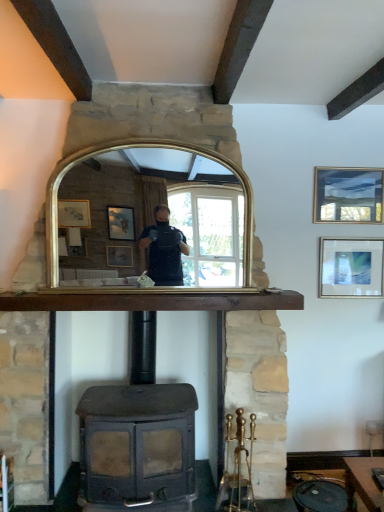
The width and height of the screenshot is (384, 512). What are the coordinates of `matte gold picture frame at upper right, which ranks as the 1th picture frame in top-to-bottom order` in the screenshot? It's located at (348, 195).

Describe the element at coordinates (351, 268) in the screenshot. The image size is (384, 512). I see `matte silver picture frame at upper right, which appears as the second picture frame when viewed from the top` at that location.

Where is `matte silver picture frame at upper right, which appears as the second picture frame when viewed from the top`? matte silver picture frame at upper right, which appears as the second picture frame when viewed from the top is located at coordinates (351, 268).

What do you see at coordinates (212, 226) in the screenshot? The height and width of the screenshot is (512, 384). I see `gold-framed mirror at center` at bounding box center [212, 226].

Locate an element on the screen. The height and width of the screenshot is (512, 384). matte black wood burning stove at center is located at coordinates (138, 435).

This screenshot has height=512, width=384. I want to click on mirror lying above the matte black wood burning stove at center (from the image's perspective), so click(x=212, y=226).

Which object is thinner, gold-framed mirror at center or matte black wood burning stove at center?

gold-framed mirror at center.

What's the angular difference between gold-framed mirror at center and matte black wood burning stove at center's facing directions?

1.44 degrees separate the facing orientations of gold-framed mirror at center and matte black wood burning stove at center.

Considering the sizes of objects gold-framed mirror at center and matte black wood burning stove at center in the image provided, who is taller, gold-framed mirror at center or matte black wood burning stove at center?

matte black wood burning stove at center.

Which object is positioned more to the left, gold-framed mirror at center or brown wooden mantle at center?

brown wooden mantle at center is more to the left.

From the image's perspective, is gold-framed mirror at center below brown wooden mantle at center?

Actually, gold-framed mirror at center appears above brown wooden mantle at center in the image.

Is gold-framed mirror at center inside or outside of brown wooden mantle at center?

gold-framed mirror at center exists outside the volume of brown wooden mantle at center.

In the image, is matte silver picture frame at upper right, the first picture frame in the bottom-to-top sequence, positioned in front of or behind brown wooden mantle at center?

matte silver picture frame at upper right, the first picture frame in the bottom-to-top sequence, is positioned farther from the viewer than brown wooden mantle at center.

Is matte silver picture frame at upper right, the first picture frame in the bottom-to-top sequence, aimed at brown wooden mantle at center?

No, matte silver picture frame at upper right, the first picture frame in the bottom-to-top sequence, does not turn towards brown wooden mantle at center.

Identify the location of mantle in front of the matte silver picture frame at upper right, the first picture frame in the bottom-to-top sequence. The width and height of the screenshot is (384, 512). (148, 300).

Looking at this image, which of these two, matte silver picture frame at upper right, the first picture frame in the bottom-to-top sequence, or brown wooden mantle at center, is bigger?

Bigger between the two is brown wooden mantle at center.

Is brown wooden mantle at center looking in the opposite direction of matte gold picture frame at upper right, the second picture frame ordered from the bottom?

brown wooden mantle at center does not have its back to matte gold picture frame at upper right, the second picture frame ordered from the bottom.

From a real-world perspective, who is located higher, brown wooden mantle at center or matte gold picture frame at upper right, the second picture frame ordered from the bottom?

From a 3D spatial view, matte gold picture frame at upper right, the second picture frame ordered from the bottom, is above.

Find the location of a particular element. picture frame that is the 2nd object located above the brown wooden mantle at center (from the image's perspective) is located at coordinates (348, 195).

From their relative heights in the image, would you say brown wooden mantle at center is taller or shorter than matte gold picture frame at upper right, which ranks as the 1th picture frame in top-to-bottom order?

Considering their sizes, brown wooden mantle at center has less height than matte gold picture frame at upper right, which ranks as the 1th picture frame in top-to-bottom order.

Does point (220, 295) appear closer or farther from the camera than point (91, 248)?

Point (220, 295) is closer to the camera than point (91, 248).

Find the location of a particular element. mantle beneath the gold-framed mirror at center (from a real-world perspective) is located at coordinates (148, 300).

Is brown wooden mantle at center with gold-framed mirror at center?

brown wooden mantle at center and gold-framed mirror at center are clearly separated.

Who is smaller, matte silver picture frame at upper right, the first picture frame in the bottom-to-top sequence, or matte gold picture frame at upper right, which ranks as the 1th picture frame in top-to-bottom order?

With smaller size is matte gold picture frame at upper right, which ranks as the 1th picture frame in top-to-bottom order.

Can you confirm if matte silver picture frame at upper right, which appears as the second picture frame when viewed from the top, is positioned to the left of matte gold picture frame at upper right, which ranks as the 1th picture frame in top-to-bottom order?

In fact, matte silver picture frame at upper right, which appears as the second picture frame when viewed from the top, is to the right of matte gold picture frame at upper right, which ranks as the 1th picture frame in top-to-bottom order.

In the scene shown: Is matte silver picture frame at upper right, which appears as the second picture frame when viewed from the top, positioned far away from matte gold picture frame at upper right, which ranks as the 1th picture frame in top-to-bottom order?

No.

Would you say matte silver picture frame at upper right, which appears as the second picture frame when viewed from the top, is outside matte gold picture frame at upper right, which ranks as the 1th picture frame in top-to-bottom order?

That's correct, matte silver picture frame at upper right, which appears as the second picture frame when viewed from the top, is outside of matte gold picture frame at upper right, which ranks as the 1th picture frame in top-to-bottom order.

Considering the sizes of objects matte black wood burning stove at center and matte silver picture frame at upper right, which appears as the second picture frame when viewed from the top, in the image provided, who is taller, matte black wood burning stove at center or matte silver picture frame at upper right, which appears as the second picture frame when viewed from the top,?

With more height is matte black wood burning stove at center.

Which object is thinner, matte black wood burning stove at center or matte silver picture frame at upper right, which appears as the second picture frame when viewed from the top?

Thinner between the two is matte silver picture frame at upper right, which appears as the second picture frame when viewed from the top.

From the picture: Is matte black wood burning stove at center spatially inside matte silver picture frame at upper right, the first picture frame in the bottom-to-top sequence, or outside of it?

The correct answer is: outside.

Identify the location of wood burning stove below the gold-framed mirror at center (from the image's perspective). (138, 435).

I want to click on mantle directly beneath the gold-framed mirror at center (from a real-world perspective), so click(148, 300).

Considering their positions, is brown wooden mantle at center positioned further to matte silver picture frame at upper right, the first picture frame in the bottom-to-top sequence, than matte gold picture frame at upper right, the second picture frame ordered from the bottom?

brown wooden mantle at center is further to matte silver picture frame at upper right, the first picture frame in the bottom-to-top sequence.

When comparing their distances from brown wooden mantle at center, does gold-framed mirror at center or matte black wood burning stove at center seem closer?

The object closer to brown wooden mantle at center is gold-framed mirror at center.

Based on their spatial positions, is matte gold picture frame at upper right, which ranks as the 1th picture frame in top-to-bottom order, or matte silver picture frame at upper right, the first picture frame in the bottom-to-top sequence, closer to brown wooden mantle at center?

matte silver picture frame at upper right, the first picture frame in the bottom-to-top sequence, lies closer to brown wooden mantle at center than the other object.

Which object lies nearer to the anchor point matte silver picture frame at upper right, which appears as the second picture frame when viewed from the top, gold-framed mirror at center or brown wooden mantle at center?

The object closer to matte silver picture frame at upper right, which appears as the second picture frame when viewed from the top, is brown wooden mantle at center.

From the image, which object appears to be nearer to brown wooden mantle at center, matte silver picture frame at upper right, the first picture frame in the bottom-to-top sequence, or matte black wood burning stove at center?

matte black wood burning stove at center is closer to brown wooden mantle at center.

When comparing their distances from matte gold picture frame at upper right, the second picture frame ordered from the bottom, does brown wooden mantle at center or matte silver picture frame at upper right, which appears as the second picture frame when viewed from the top, seem further?

brown wooden mantle at center.

Based on their spatial positions, is matte black wood burning stove at center or matte gold picture frame at upper right, which ranks as the 1th picture frame in top-to-bottom order, closer to matte silver picture frame at upper right, the first picture frame in the bottom-to-top sequence?

matte gold picture frame at upper right, which ranks as the 1th picture frame in top-to-bottom order, is closer to matte silver picture frame at upper right, the first picture frame in the bottom-to-top sequence.

Looking at the image, which one is located further to gold-framed mirror at center, matte silver picture frame at upper right, which appears as the second picture frame when viewed from the top, or matte gold picture frame at upper right, which ranks as the 1th picture frame in top-to-bottom order?

matte silver picture frame at upper right, which appears as the second picture frame when viewed from the top, is positioned further to the anchor gold-framed mirror at center.

At what (x,y) coordinates should I click in order to perform the action: click on mirror between brown wooden mantle at center and matte silver picture frame at upper right, the first picture frame in the bottom-to-top sequence, from left to right. Please return your answer as a coordinate pair (x, y). The image size is (384, 512). Looking at the image, I should click on (212, 226).

The image size is (384, 512). I want to click on wood burning stove situated between brown wooden mantle at center and matte gold picture frame at upper right, which ranks as the 1th picture frame in top-to-bottom order, from left to right, so click(138, 435).

Find the location of a particular element. This screenshot has height=512, width=384. picture frame located between gold-framed mirror at center and matte silver picture frame at upper right, which appears as the second picture frame when viewed from the top, in the left-right direction is located at coordinates (348, 195).

What are the coordinates of `mantle that lies between gold-framed mirror at center and matte black wood burning stove at center from top to bottom` in the screenshot? It's located at (148, 300).